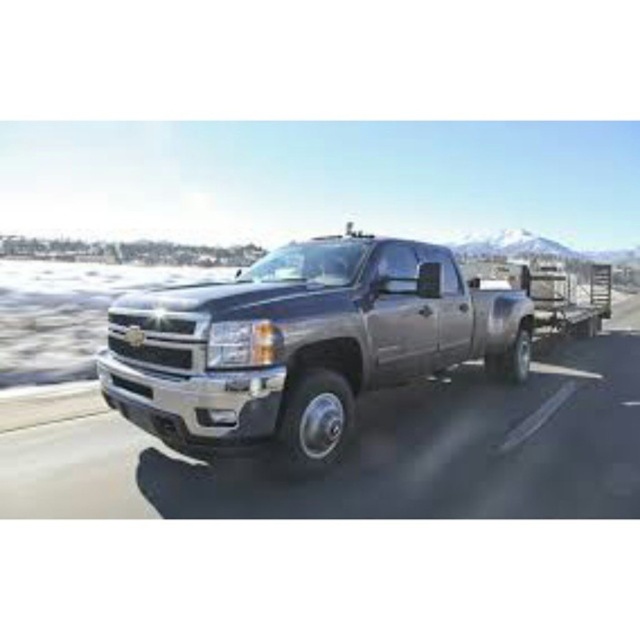
You are a photographer standing on the side of the road. You want to take a photo of the metallic gray truck at center and the satin metallic pickup truck at center. Which truck will appear larger in your photo?

The metallic gray truck at center will appear larger in the photo because it is closer to the viewer than the satin metallic pickup truck at center.

You are a photographer trying to capture both the metallic gray truck at center and the satin metallic pickup truck at center in a single shot. Since you want to emphasize the size difference between them, which truck should you position closer to the camera to achieve this effect?

To emphasize the size difference between the metallic gray truck at center and the satin metallic pickup truck at center, position the smaller metallic gray truck at center closer to the camera. This will make it appear larger in comparison to the larger truck farther away, enhancing the visual contrast between their sizes.

You are standing at the origin point of the coordinate system where the bottom left corner of the image is the origin. The truck is at point (378,452). If you want to move towards the truck, in which direction should you walk? Please answer with either left, right, up, or down.

The metallic gray truck at center is located at point (378,452). Since the coordinate system has the origin at the bottom left corner, moving towards the truck from the origin would require moving to the right and up. However, since the question asks for a single direction, the primary direction would be right as the x coordinate is positive. But according to the problem, the answer should be either left, right, up, or down. The truck is at x 0.708 and y 0.592. From the origin, to reach it, you need to 0